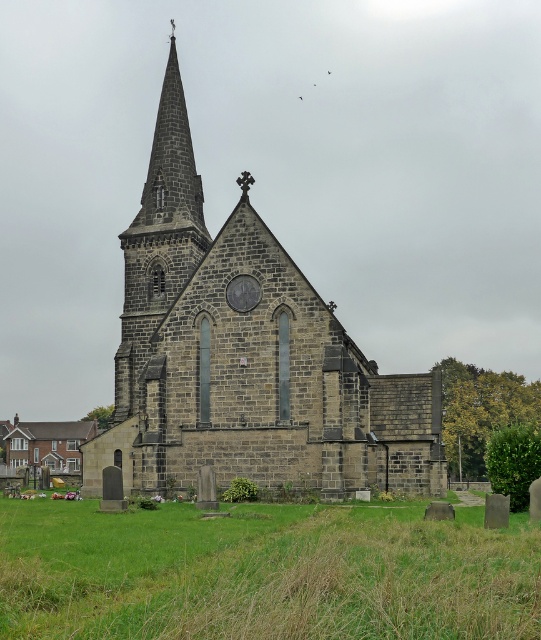
The image size is (541, 640). What do you see at coordinates (246, 356) in the screenshot?
I see `dark gray stone church at center` at bounding box center [246, 356].

Find the location of a particular element. dark gray stone church at center is located at coordinates (246, 356).